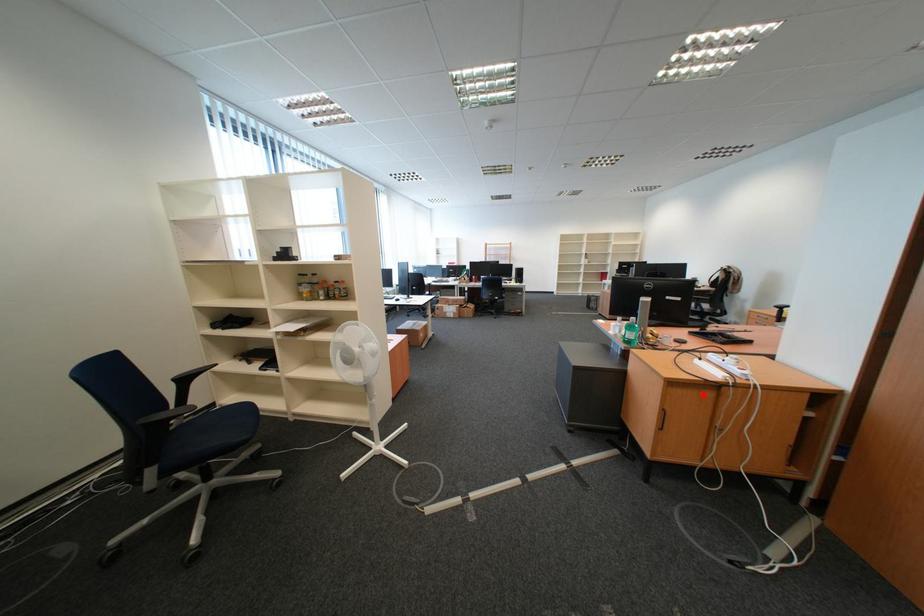
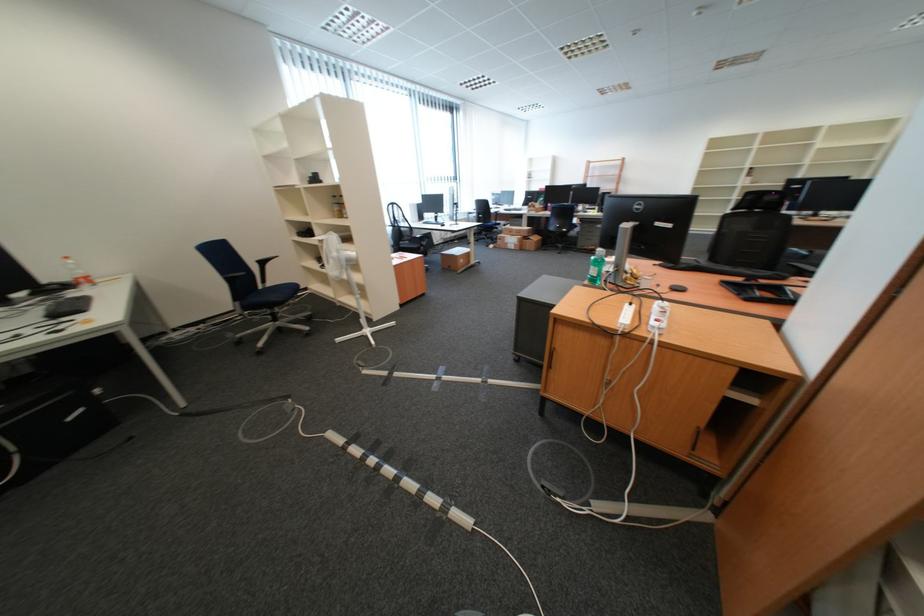
Question: I am providing you with two images of the same scene from different viewpoints. A red point is marked on the first image. At the location where the point appears in image 1, is it still visible in image 2?

Choices:
 (A) Yes
 (B) No

Answer: (A)